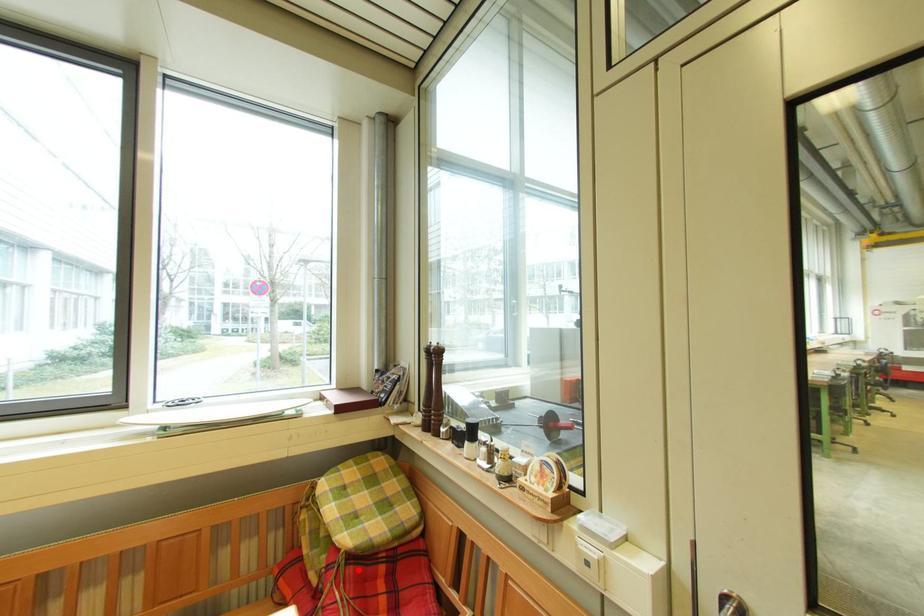
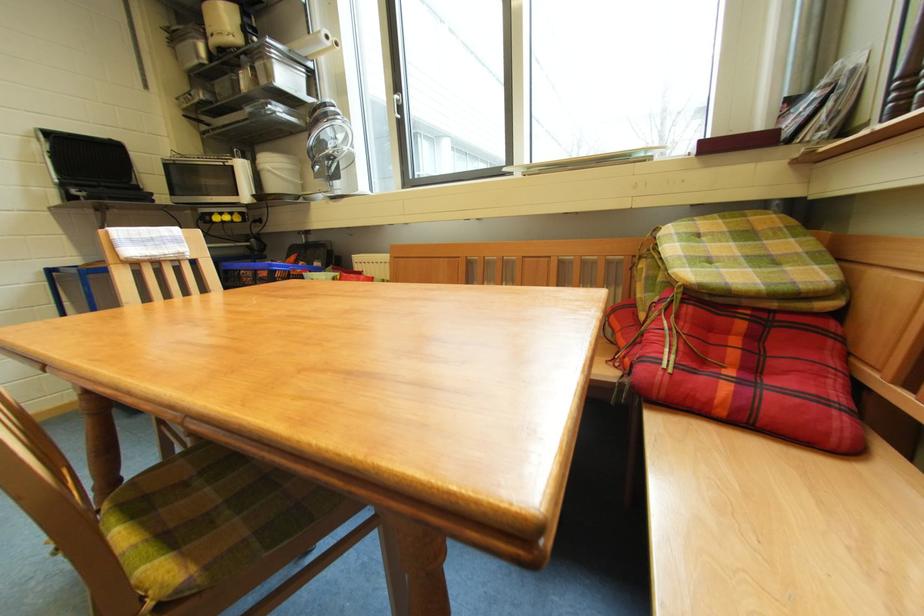
In the second image, find the point that corresponds to the highlighted location in the first image.

(698, 310)